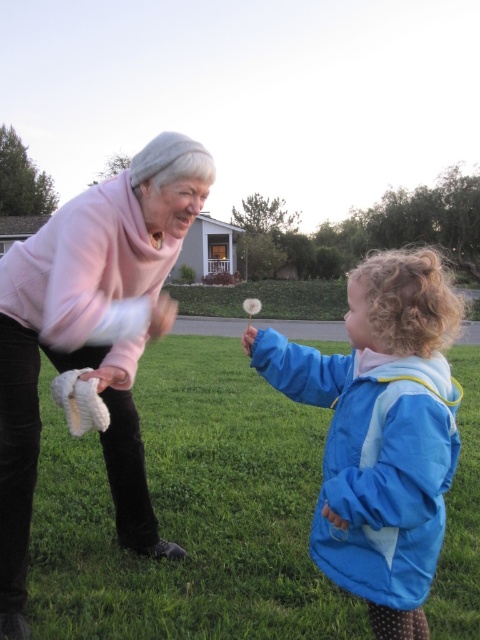
You are a tailor who needs to determine which item takes up more space in the image for a project. Which item is larger in size between the pink fleece sweater at upper left and the blue fabric dandelion at center?

The blue fabric dandelion at center occupies more space than the pink fleece sweater at upper left.

You are a photographer trying to capture the perfect shot of the green grass at center and the blue fabric dandelion at center. Based on their positions, which object should you focus on first if you want to frame them both in a single shot?

The green grass at center is to the left of the blue fabric dandelion at center, so you should focus on the blue fabric dandelion at center first to ensure both are framed properly in the shot.

You are a photographer trying to capture a photo of the blue fabric dandelion at center and the pink fleece sweater at upper left. Which object should you focus on first if you want to include both in the frame without moving the camera?

The pink fleece sweater at upper left is positioned on the left side of the blue fabric dandelion at center, so you should focus on the pink fleece sweater at upper left first to ensure both are in the frame.